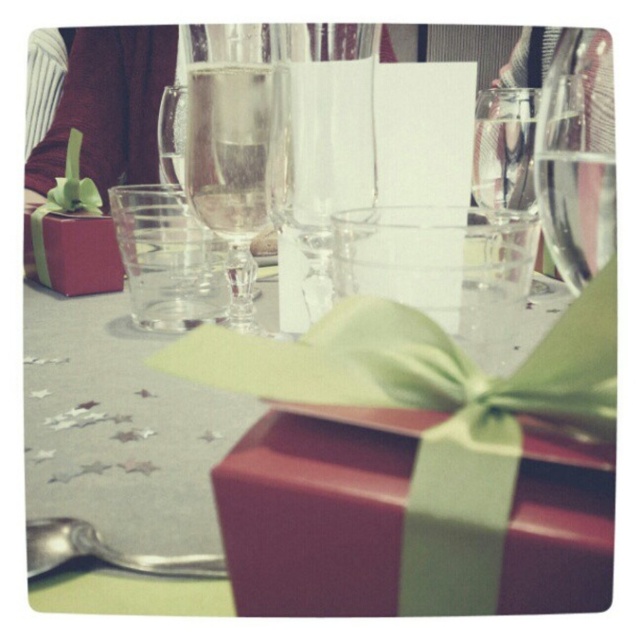
Question: Which point appears closest to the camera in this image?

Choices:
 (A) (243, 38)
 (B) (572, 204)

Answer: (B)

Question: Can you confirm if transparent glass wine glass at upper center is positioned above shiny silver spoon at lower left?

Choices:
 (A) yes
 (B) no

Answer: (A)

Question: Where is transparent glass wine glass at center located in relation to transparent glass wine glass at upper center in the image?

Choices:
 (A) below
 (B) above

Answer: (B)

Question: Which point is farther to the camera?

Choices:
 (A) (580, 369)
 (B) (580, 554)
 (C) (250, 310)

Answer: (C)

Question: Which point is closer to the camera?

Choices:
 (A) (60, 550)
 (B) (554, 209)
 (C) (611, 476)
 (D) (262, 484)

Answer: (D)

Question: Where is transparent glass wine glass at center located in relation to shiny silver spoon at lower left in the image?

Choices:
 (A) above
 (B) below

Answer: (A)